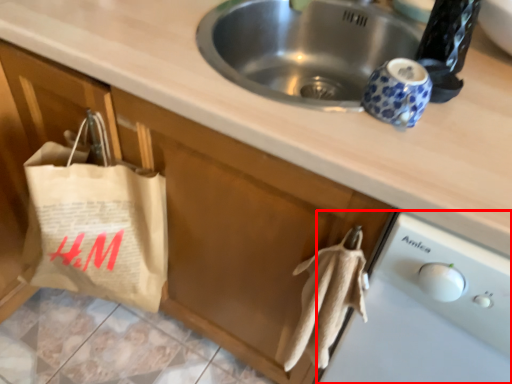
Question: In this image, where is dish washer (annotated by the red box) located relative to grocery bag?

Choices:
 (A) left
 (B) right

Answer: (B)